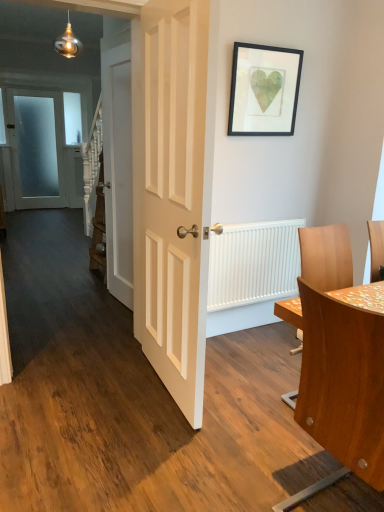
Question: Which direction should I rotate to look at white wooden door at center, acting as the 2th door starting from the left, — up or down?

Choices:
 (A) up
 (B) down

Answer: (A)

Question: Can you confirm if white ribbed radiator at right is bigger than wooden table at right?

Choices:
 (A) no
 (B) yes

Answer: (A)

Question: Is white ribbed radiator at right smaller than wooden table at right?

Choices:
 (A) no
 (B) yes

Answer: (B)

Question: Considering the relative sizes of white ribbed radiator at right and wooden table at right in the image provided, is white ribbed radiator at right wider than wooden table at right?

Choices:
 (A) yes
 (B) no

Answer: (B)

Question: Is white ribbed radiator at right behind wooden table at right?

Choices:
 (A) yes
 (B) no

Answer: (A)

Question: Is white ribbed radiator at right facing away from wooden table at right?

Choices:
 (A) yes
 (B) no

Answer: (B)

Question: Can wooden table at right be found inside white ribbed radiator at right?

Choices:
 (A) no
 (B) yes

Answer: (A)

Question: Does wooden table at right have a lesser height compared to white glossy door at center, the first door when ordered from front to back?

Choices:
 (A) no
 (B) yes

Answer: (B)

Question: Is white glossy door at center, the first door when ordered from front to back, completely or partially inside wooden table at right?

Choices:
 (A) yes
 (B) no

Answer: (B)

Question: Is wooden table at right wider than white glossy door at center, the first door when ordered from front to back?

Choices:
 (A) no
 (B) yes

Answer: (B)

Question: From the image's perspective, would you say wooden table at right is positioned over white glossy door at center, the first door when ordered from front to back?

Choices:
 (A) no
 (B) yes

Answer: (A)

Question: Is wooden table at right turned away from white glossy door at center, which appears as the 1th door when viewed from the right?

Choices:
 (A) yes
 (B) no

Answer: (B)

Question: Can you confirm if wooden table at right is taller than white glossy door at center, the first door when ordered from front to back?

Choices:
 (A) yes
 (B) no

Answer: (B)

Question: Is frosted glass door at left, the 1th door viewed from the left, taller than white ribbed radiator at right?

Choices:
 (A) no
 (B) yes

Answer: (B)